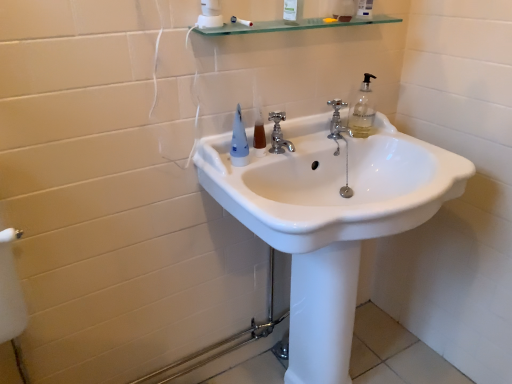
Question: Does translucent plastic mouthwash at center have a lesser height compared to polished chrome faucet at center, which ranks as the 1th tap in front-to-back order?

Choices:
 (A) no
 (B) yes

Answer: (B)

Question: Considering the relative positions of translucent plastic mouthwash at center and polished chrome faucet at center, which ranks as the 1th tap in front-to-back order, in the image provided, is translucent plastic mouthwash at center to the left of polished chrome faucet at center, which ranks as the 1th tap in front-to-back order, from the viewer's perspective?

Choices:
 (A) no
 (B) yes

Answer: (B)

Question: From a real-world perspective, is translucent plastic mouthwash at center physically above polished chrome faucet at center, which ranks as the 1th tap in front-to-back order?

Choices:
 (A) yes
 (B) no

Answer: (B)

Question: Is translucent plastic mouthwash at center positioned far away from polished chrome faucet at center, the second tap when ordered from right to left?

Choices:
 (A) no
 (B) yes

Answer: (A)

Question: Is translucent plastic mouthwash at center outside of polished chrome faucet at center, the 1th tap from the left?

Choices:
 (A) no
 (B) yes

Answer: (B)

Question: From a real-world perspective, is white glossy sink at center above or below translucent plastic mouthwash at center?

Choices:
 (A) below
 (B) above

Answer: (A)

Question: Looking at their shapes, would you say white glossy sink at center is wider or thinner than translucent plastic mouthwash at center?

Choices:
 (A) thin
 (B) wide

Answer: (B)

Question: Considering the positions of point (285, 157) and point (256, 109), is point (285, 157) closer or farther from the camera than point (256, 109)?

Choices:
 (A) closer
 (B) farther

Answer: (A)

Question: In the image, is white glossy sink at center positioned in front of or behind translucent plastic mouthwash at center?

Choices:
 (A) front
 (B) behind

Answer: (A)

Question: Considering the positions of translucent plastic mouthwash at center and polished chrome faucet at center, the 1th tap positioned from the right, in the image, is translucent plastic mouthwash at center wider or thinner than polished chrome faucet at center, the 1th tap positioned from the right,?

Choices:
 (A) thin
 (B) wide

Answer: (A)

Question: From a real-world perspective, is translucent plastic mouthwash at center positioned above or below polished chrome faucet at center, which is the 2th tap from left to right?

Choices:
 (A) below
 (B) above

Answer: (A)

Question: Is translucent plastic mouthwash at center inside the boundaries of polished chrome faucet at center, arranged as the first tap when viewed from the back, or outside?

Choices:
 (A) inside
 (B) outside

Answer: (B)

Question: In terms of size, does translucent plastic mouthwash at center appear bigger or smaller than polished chrome faucet at center, the 1th tap positioned from the right?

Choices:
 (A) big
 (B) small

Answer: (B)

Question: Is transparent glass shelf at upper center wider or thinner than polished chrome faucet at center, which is the 2th tap from left to right?

Choices:
 (A) thin
 (B) wide

Answer: (B)

Question: In terms of size, does transparent glass shelf at upper center appear bigger or smaller than polished chrome faucet at center, the second tap in the front-to-back sequence?

Choices:
 (A) big
 (B) small

Answer: (A)